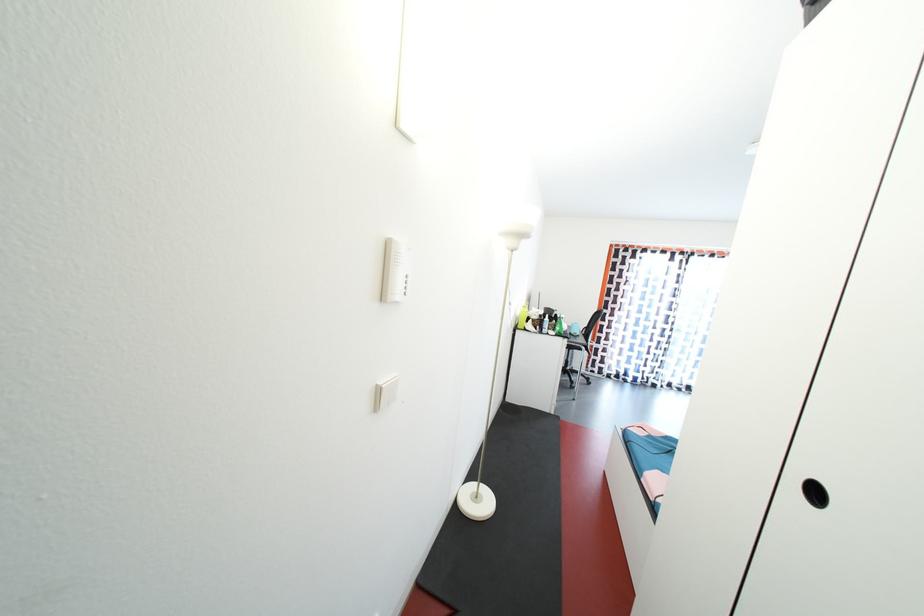
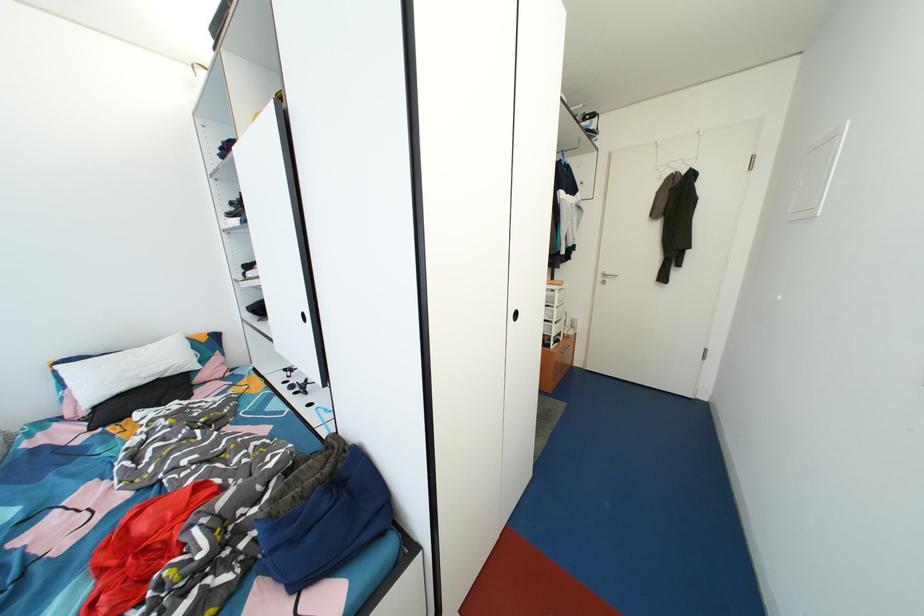
The point at (821, 498) is marked in the first image. Where is the corresponding point in the second image?

(523, 320)